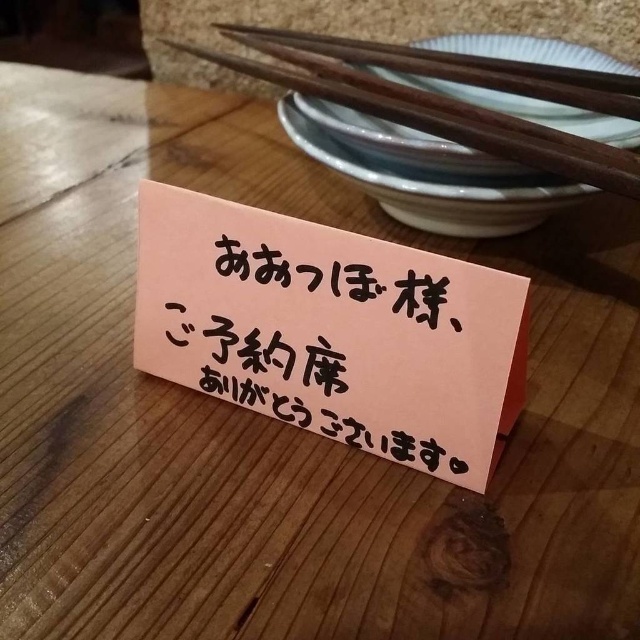
You are a server in a restaurant. You need to place a new menu next to the pink paper sign at center without blocking the wooden chopsticks at upper right. The menu is 10 inches wide. Is there enough space between them to place the menu?

The pink paper sign at center and wooden chopsticks at upper right are 20.34 inches apart. Since the menu is 10 inches wide, there is sufficient space between them to place the menu without blocking the chopsticks.

In the scene shown: You are a waiter in a restaurant and need to place an order slip between the two points on the table. The first point is point (179, 348) and the second point is point (579, 90). Which point should you place the slip closer to so that it is in front of the other point?

You should place the order slip closer to point (179, 348) because it is in front of point (579, 90), making it more visible from the front.